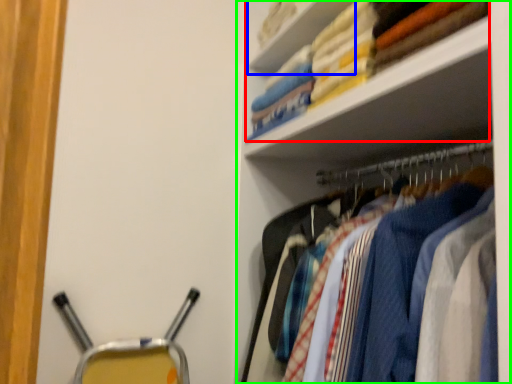
Question: Which object is the farthest from laundry (highlighted by a red box)? Choose among these: cabinet (highlighted by a blue box) or shelf (highlighted by a green box).

Choices:
 (A) cabinet
 (B) shelf

Answer: (B)